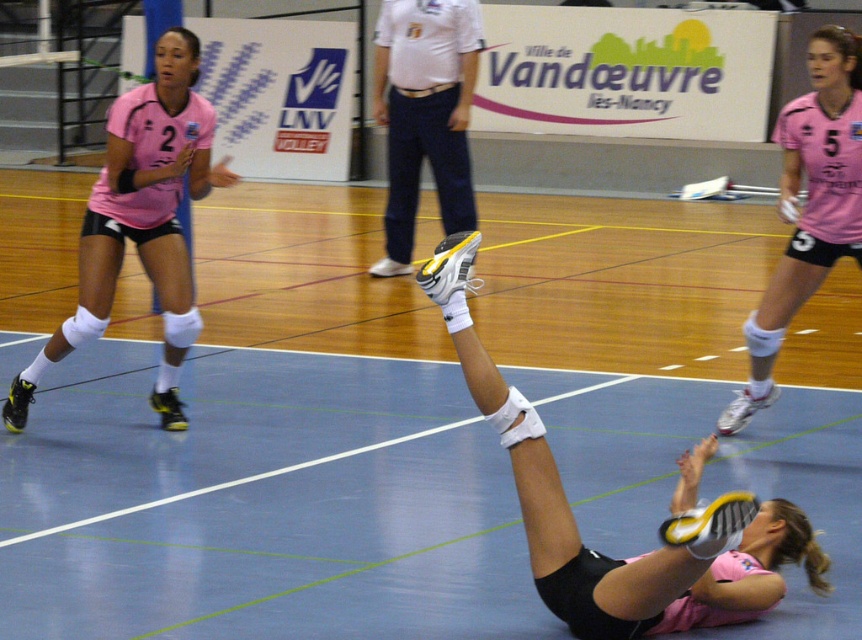
You are a photographer standing at the back of the sports hall. You want to take a photo of the volleyball player in the pink jersey with the number 3. The player is lying on the court, and you notice two points marked on the image at coordinates point [741,584] and point [460,99]. Which point should you focus on to ensure the player is in sharp focus?

You should focus on point [741,584] because it is closer to the camera than point [460,99], ensuring the player in the pink jersey with the number 3 is in sharp focus.

You are a photographer standing at the center of the volleyball court. You want to take a photo that includes both the matte pink shorts at lower right and the pink jersey at upper right. What is the minimum distance you need to move forward to ensure both objects are in your frame?

The matte pink shorts at lower right and the pink jersey at upper right are 3.20 meters apart. To include both in your photo, you need to move forward until the distance between them fits within your camera frame. However, without knowing the camera sensor size or focal length, it is impossible to calculate the exact distance. But since the objects are 3.20 meters apart, you must ensure your camera can capture that span at your current position. If not, moving closer would reduce the required field of view.